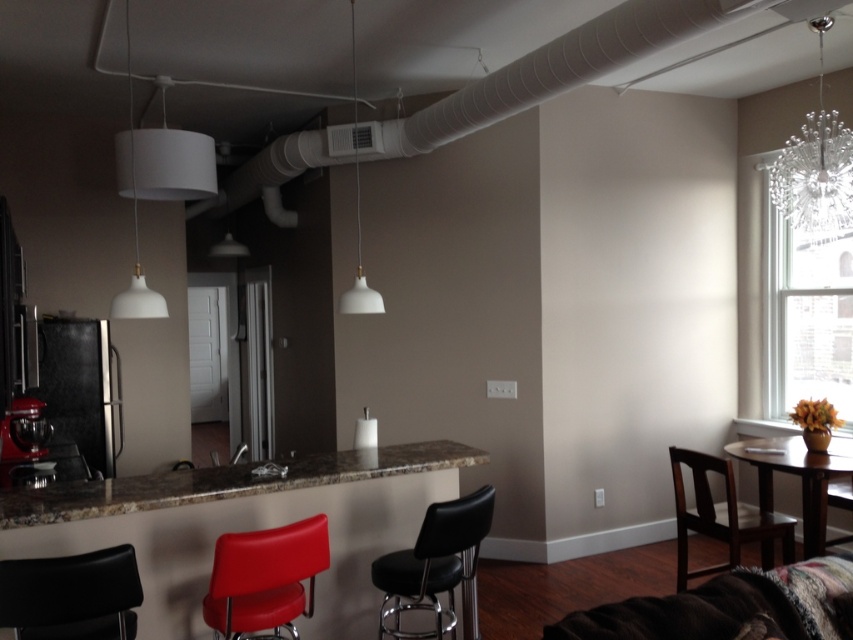
Does black leather chair at lower left have a lesser width compared to brown wooden chair at lower right?

Correct, black leather chair at lower left's width is less than brown wooden chair at lower right's.

Is point (74, 634) positioned behind point (706, 515)?

No.

This screenshot has height=640, width=853. I want to click on black leather chair at lower left, so click(71, 595).

Is brown granite counter top at center bigger than white matte pendant light at upper left?

Yes, brown granite counter top at center is bigger than white matte pendant light at upper left.

Based on the photo, who is more distant from viewer, (173,476) or (132,186)?

Positioned behind is point (173,476).

In order to click on brown granite counter top at center in this screenshot , I will do `click(222, 483)`.

Which is behind, point (836, 449) or point (379, 296)?

Point (836, 449)

Who is higher up, brown wooden table at lower right or white matte lampshade at center?

white matte lampshade at center is higher up.

Find the location of a particular element. Image resolution: width=853 pixels, height=640 pixels. brown wooden table at lower right is located at coordinates (x=798, y=476).

I want to click on brown wooden table at lower right, so click(798, 476).